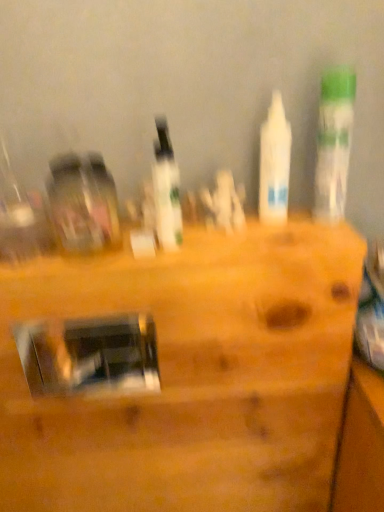
Locate an element on the screen. This screenshot has height=512, width=384. vacant space in between white glossy bottle at upper right, the first bottle viewed from the right, and white glossy bottle at center, arranged as the 3th bottle when viewed from the right is located at coordinates (253, 230).